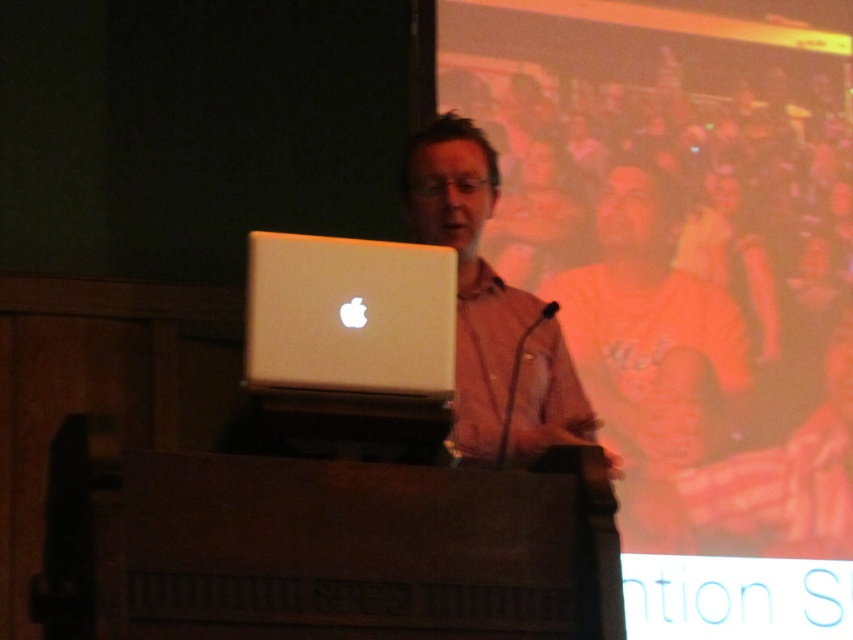
Question: Does silver metallic laptop at center lie behind matte white laptop at center?

Choices:
 (A) no
 (B) yes

Answer: (A)

Question: Which of the following is the farthest from the observer?

Choices:
 (A) matte white laptop at center
 (B) silver metallic laptop at center

Answer: (A)

Question: Can you confirm if silver metallic laptop at center is smaller than matte white laptop at center?

Choices:
 (A) yes
 (B) no

Answer: (A)

Question: Can you confirm if silver metallic laptop at center is positioned to the right of matte white laptop at center?

Choices:
 (A) no
 (B) yes

Answer: (A)

Question: Among these points, which one is nearest to the camera?

Choices:
 (A) (523, 412)
 (B) (404, 310)

Answer: (B)